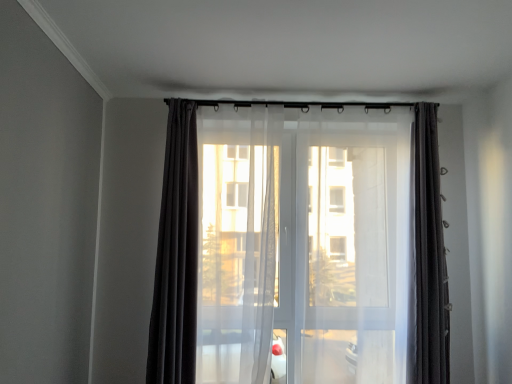
Question: Are matte black curtain at center, acting as the first curtain starting from the left, and transparent fabric screen door at center beside each other?

Choices:
 (A) yes
 (B) no

Answer: (B)

Question: Is matte black curtain at center, which ranks as the third curtain in right-to-left order, facing away from transparent fabric screen door at center?

Choices:
 (A) no
 (B) yes

Answer: (A)

Question: Is matte black curtain at center, acting as the first curtain starting from the left, thinner than transparent fabric screen door at center?

Choices:
 (A) yes
 (B) no

Answer: (B)

Question: Can you confirm if matte black curtain at center, acting as the first curtain starting from the left, is taller than transparent fabric screen door at center?

Choices:
 (A) yes
 (B) no

Answer: (B)

Question: Would you consider matte black curtain at center, acting as the first curtain starting from the left, to be distant from transparent fabric screen door at center?

Choices:
 (A) yes
 (B) no

Answer: (B)

Question: From a real-world perspective, is matte black curtain at center, which ranks as the third curtain in right-to-left order, physically below transparent fabric screen door at center?

Choices:
 (A) yes
 (B) no

Answer: (B)

Question: Is matte black curtain at center, which is the 3th curtain in left-to-right order, aimed at sheer white curtain at center, positioned as the 2th curtain in right-to-left order?

Choices:
 (A) no
 (B) yes

Answer: (A)

Question: Does matte black curtain at center, the first curtain viewed from the right, come behind sheer white curtain at center, positioned as the 2th curtain in right-to-left order?

Choices:
 (A) no
 (B) yes

Answer: (A)

Question: From the image's perspective, is matte black curtain at center, which is the 3th curtain in left-to-right order, on top of sheer white curtain at center, the 2th curtain when ordered from left to right?

Choices:
 (A) no
 (B) yes

Answer: (B)

Question: Is matte black curtain at center, which is the 3th curtain in left-to-right order, positioned far away from sheer white curtain at center, the 2th curtain when ordered from left to right?

Choices:
 (A) no
 (B) yes

Answer: (B)

Question: Can sheer white curtain at center, positioned as the 2th curtain in right-to-left order, be found inside matte black curtain at center, the first curtain viewed from the right?

Choices:
 (A) no
 (B) yes

Answer: (A)

Question: Can you confirm if matte black curtain at center, the first curtain viewed from the right, is taller than sheer white curtain at center, positioned as the 2th curtain in right-to-left order?

Choices:
 (A) no
 (B) yes

Answer: (A)

Question: Can you confirm if transparent fabric screen door at center is positioned to the left of sheer white curtain at center, the 2th curtain when ordered from left to right?

Choices:
 (A) yes
 (B) no

Answer: (B)